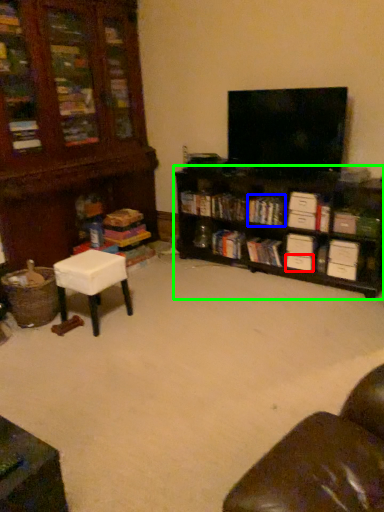
Question: Based on their relative distances, which object is farther from drawer (highlighted by a red box)? Choose from book (highlighted by a blue box) and shelf (highlighted by a green box).

Choices:
 (A) book
 (B) shelf

Answer: (B)